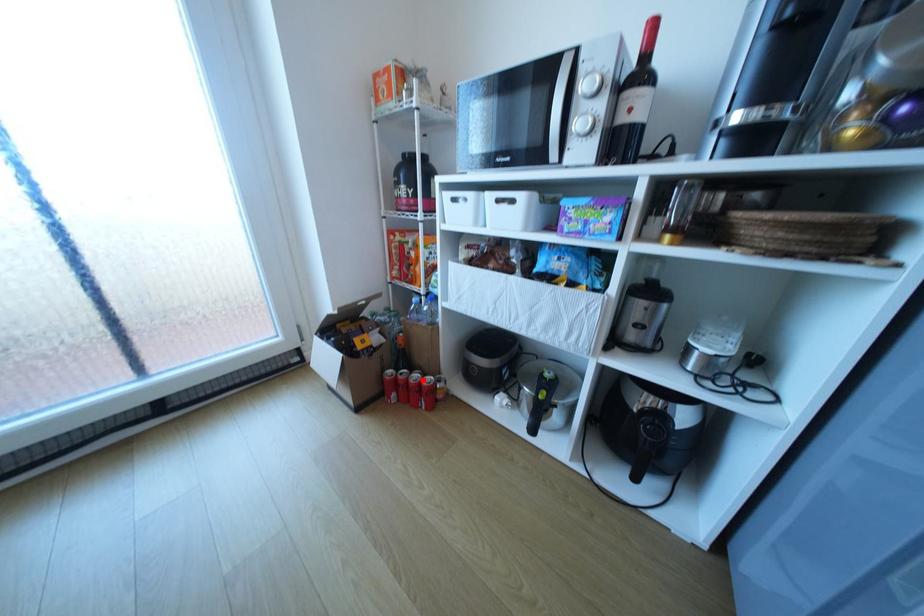
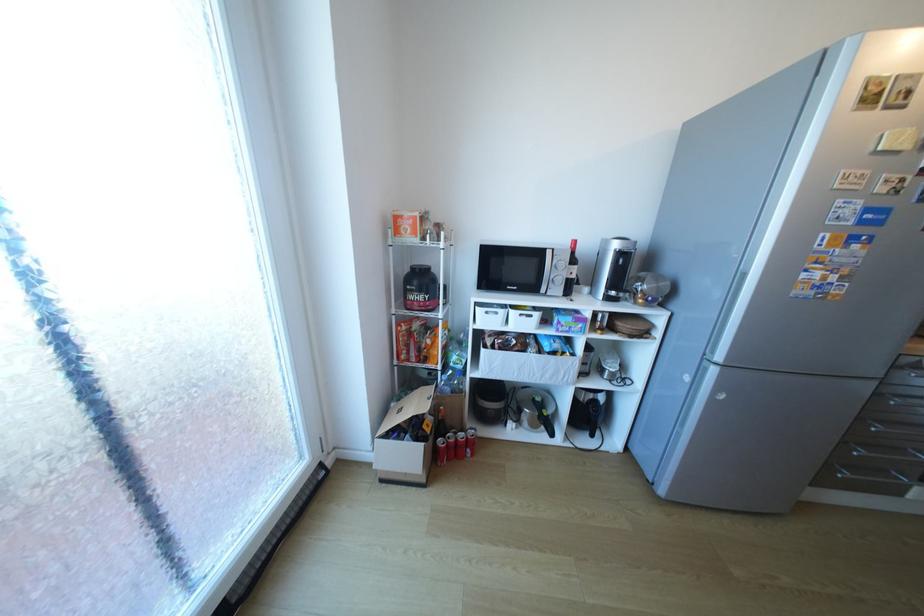
Question: I am providing you with two images of the same scene from different viewpoints. In image1, a red point is highlighted. Considering the same 3D point in image2, which of the following is correct?

Choices:
 (A) It is closer
 (B) It is farther

Answer: (B)